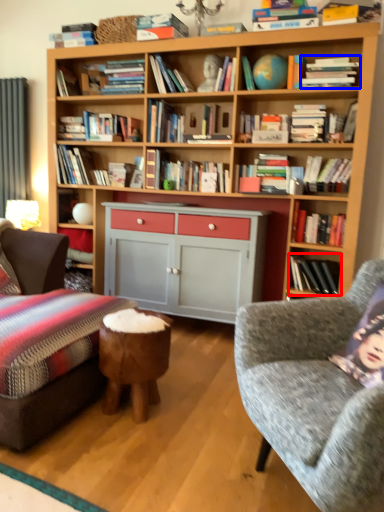
Question: Which point is further to the camera, book (highlighted by a red box) or magazine (highlighted by a blue box)?

Choices:
 (A) book
 (B) magazine

Answer: (A)